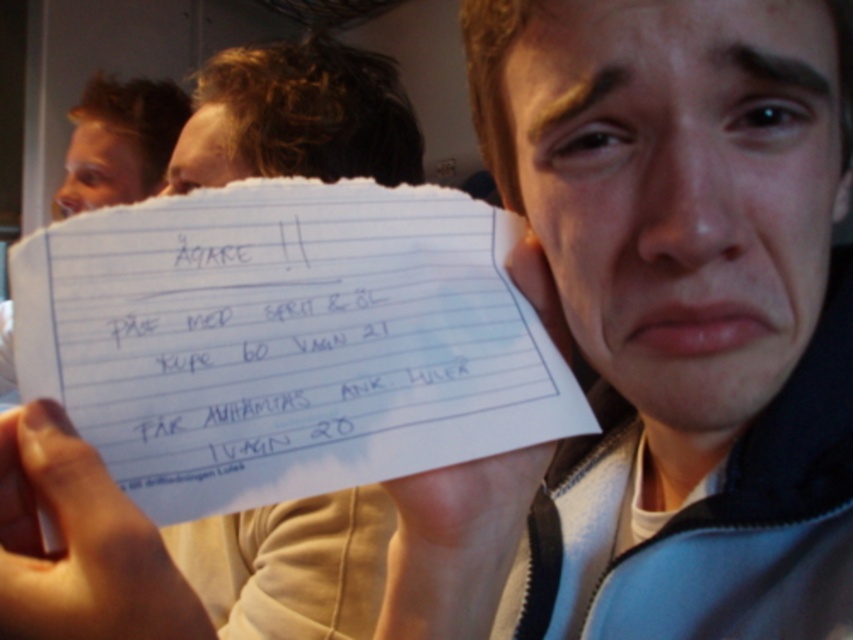
Between white paper at center and matte white nose at center, which one has more height?

Standing taller between the two is matte white nose at center.

Based on the photo, who is lower down, white paper at center or matte white nose at center?

Positioned lower is white paper at center.

Describe the element at coordinates (294, 346) in the screenshot. I see `white paper at center` at that location.

Find the location of a particular element. The width and height of the screenshot is (853, 640). white paper at center is located at coordinates (294, 346).

Between matte white nose at center and white paper at left, which one has more height?

With more height is white paper at left.

Can you confirm if matte white nose at center is positioned above white paper at left?

No.

Which is in front, point (660, 252) or point (180, 104)?

Point (660, 252) is more forward.

Where is `matte white nose at center`? Image resolution: width=853 pixels, height=640 pixels. matte white nose at center is located at coordinates (689, 198).

Does white lined paper at center appear on the right side of white paper at center?

No, white lined paper at center is not to the right of white paper at center.

Which is behind, point (550, 380) or point (334, 400)?

Point (550, 380)

Between point (426, 355) and point (424, 468), which one is positioned in front?

Positioned in front is point (424, 468).

Where is `white lined paper at center`? The image size is (853, 640). white lined paper at center is located at coordinates (286, 340).